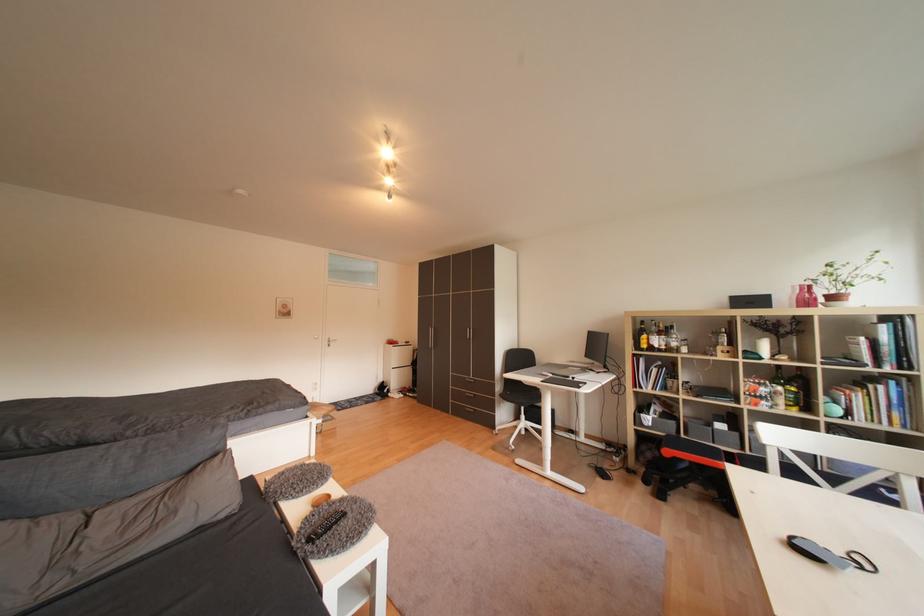
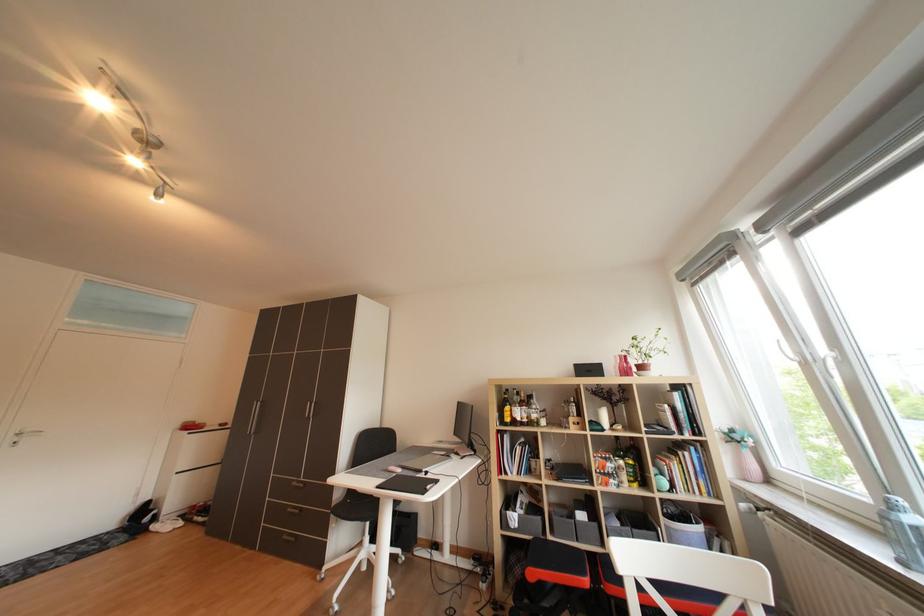
Question: How did the camera likely rotate?

Choices:
 (A) Left
 (B) Right
 (C) Up
 (D) Down

Answer: (B)